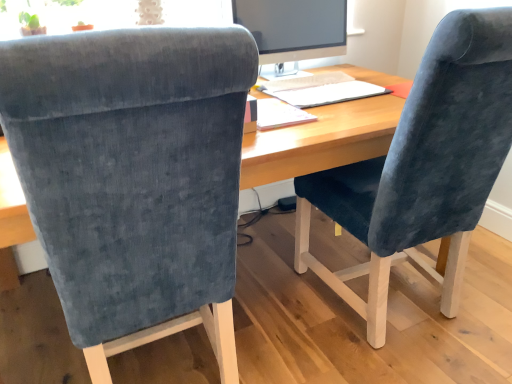
Question: From a real-world perspective, is white paper notepad at center located beneath velvet blue chair at center, the second chair viewed from the right?

Choices:
 (A) no
 (B) yes

Answer: (A)

Question: Can you confirm if white paper notepad at center is wider than velvet blue chair at center, which is counted as the 1th chair, starting from the left?

Choices:
 (A) yes
 (B) no

Answer: (B)

Question: Is white paper notepad at center smaller than velvet blue chair at center, which is counted as the 1th chair, starting from the left?

Choices:
 (A) no
 (B) yes

Answer: (B)

Question: Could you tell me if white paper notepad at center is turned towards velvet blue chair at center, the second chair viewed from the right?

Choices:
 (A) no
 (B) yes

Answer: (A)

Question: Is white paper notepad at center bigger than velvet blue chair at center, the second chair viewed from the right?

Choices:
 (A) no
 (B) yes

Answer: (A)

Question: Is point (281, 21) positioned closer to the camera than point (426, 117)?

Choices:
 (A) farther
 (B) closer

Answer: (A)

Question: Looking at the image, does matte black monitor at upper center seem bigger or smaller compared to velvet blue chair at right, the 2th chair viewed from the left?

Choices:
 (A) small
 (B) big

Answer: (A)

Question: From a real-world perspective, is matte black monitor at upper center positioned above or below velvet blue chair at right, the 2th chair viewed from the left?

Choices:
 (A) below
 (B) above

Answer: (B)

Question: Based on their positions, is matte black monitor at upper center located to the left or right of velvet blue chair at right, which is the first chair from right to left?

Choices:
 (A) left
 (B) right

Answer: (A)

Question: Looking at the image, does velvet blue chair at right, which is the first chair from right to left, seem bigger or smaller compared to wooden desk at center?

Choices:
 (A) big
 (B) small

Answer: (B)

Question: Considering the positions of point (426, 139) and point (23, 198), is point (426, 139) closer or farther from the camera than point (23, 198)?

Choices:
 (A) farther
 (B) closer

Answer: (A)

Question: In terms of width, does velvet blue chair at right, which is the first chair from right to left, look wider or thinner when compared to wooden desk at center?

Choices:
 (A) wide
 (B) thin

Answer: (B)

Question: In the image, is velvet blue chair at right, the 2th chair viewed from the left, on the left side or the right side of wooden desk at center?

Choices:
 (A) right
 (B) left

Answer: (A)

Question: Is point (296, 41) positioned closer to the camera than point (96, 271)?

Choices:
 (A) farther
 (B) closer

Answer: (A)

Question: Considering the relative positions of matte black monitor at upper center and velvet blue chair at center, which is counted as the 1th chair, starting from the left, in the image provided, is matte black monitor at upper center to the left or to the right of velvet blue chair at center, which is counted as the 1th chair, starting from the left,?

Choices:
 (A) left
 (B) right

Answer: (B)